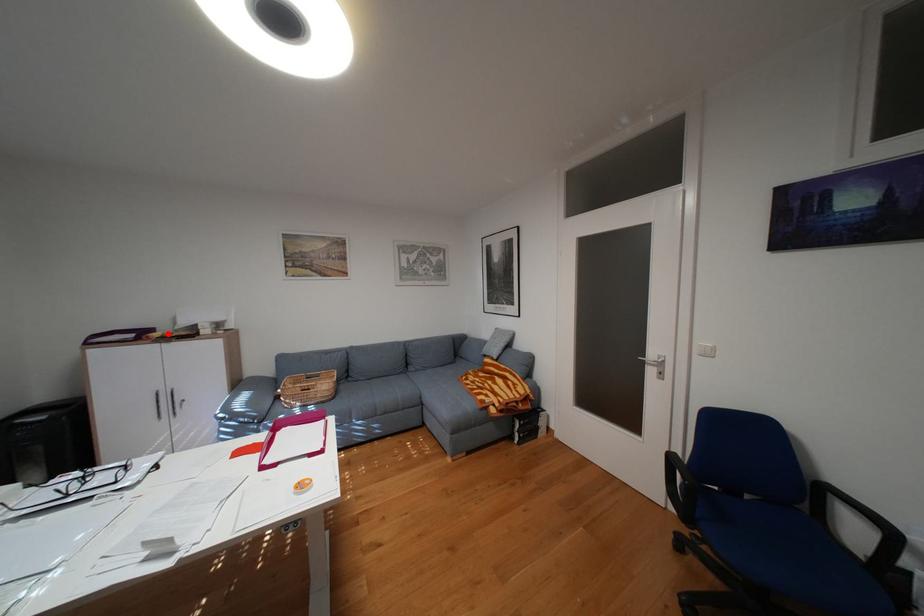
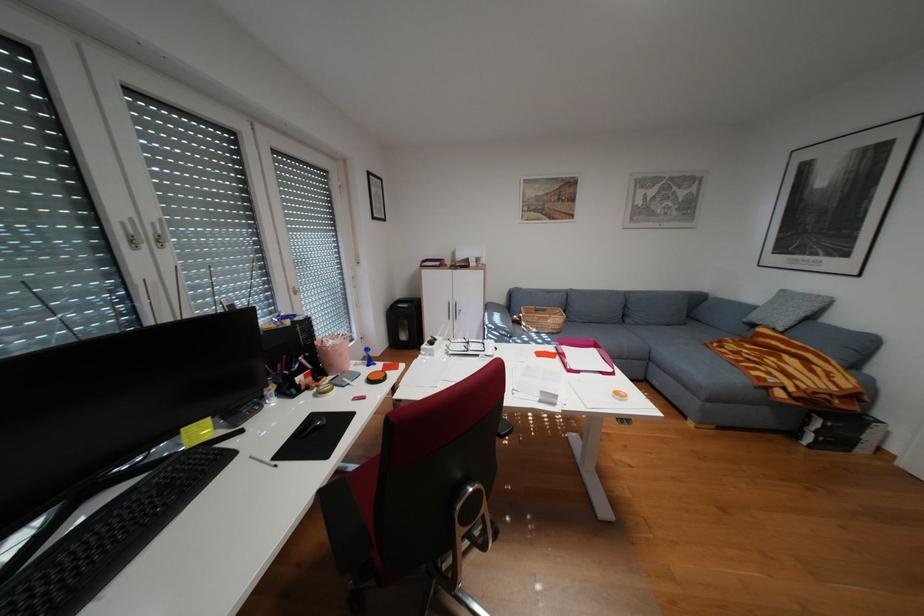
Where in the second image is the point corresponding to the highlighted location from the first image?

(460, 262)